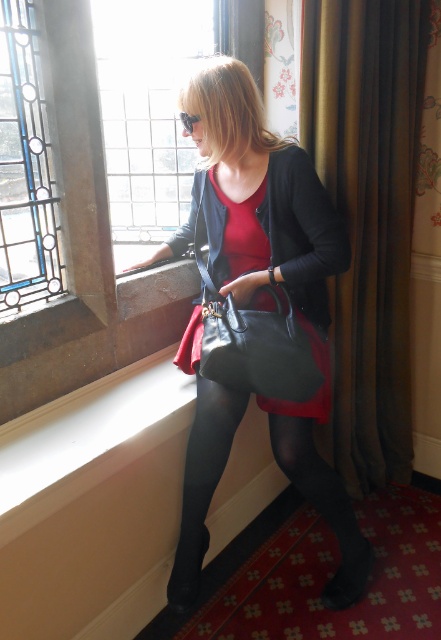
Question: Does matte black dress at center have a larger size compared to black leather handbag at center?

Choices:
 (A) yes
 (B) no

Answer: (A)

Question: Which point is closer to the camera taking this photo?

Choices:
 (A) (225, 170)
 (B) (261, 218)
 (C) (191, 129)

Answer: (C)

Question: Is matte black handbag at center closer to camera compared to brown velvet curtain at right?

Choices:
 (A) no
 (B) yes

Answer: (B)

Question: Which object is the farthest from the matte black handbag at center?

Choices:
 (A) sunglasses at upper center
 (B) black tights at lower center
 (C) brown velvet curtain at right
 (D) black leather handbag at center

Answer: (A)

Question: Which object appears closest to the camera in this image?

Choices:
 (A) brown velvet curtain at right
 (B) matte black dress at center
 (C) stained glass window at left

Answer: (C)

Question: Does matte black dress at center have a greater width compared to black leather handbag at center?

Choices:
 (A) no
 (B) yes

Answer: (B)